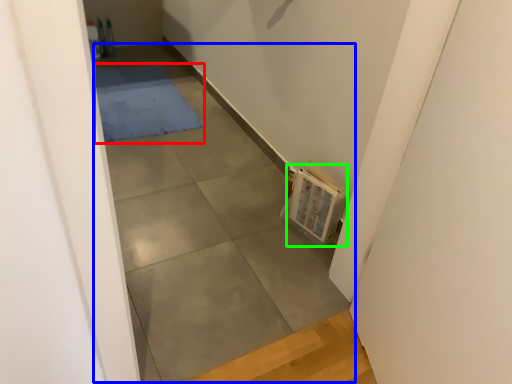
Question: Based on their relative distances, which object is farther from mat (highlighted by a red box)? Choose from concrete (highlighted by a blue box) and book (highlighted by a green box).

Choices:
 (A) concrete
 (B) book

Answer: (B)